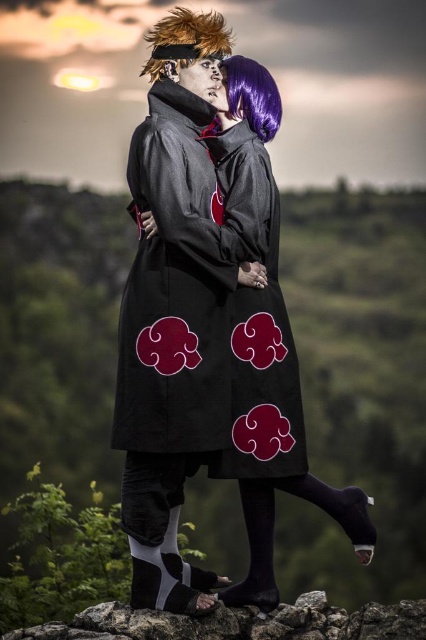
You are a photographer trying to capture a clear shot of both the black fabric cloak at center and the purple silky wig at upper center. Based on their positions, which object will appear taller in the photo?

The black fabric cloak at center will appear taller in the photo since it has a greater height compared to the purple silky wig at upper center according to the description.

You are a photographer trying to capture a closeup of the purple silky wig at upper center without the smooth rock at lower center appearing in the frame. Based on their positions, is this possible?

Yes, the smooth rock at lower center is positioned under the purple silky wig at upper center, so adjusting the camera angle slightly upward would allow the photographer to focus on the purple silky wig at upper center while excluding the rock from the frame.

You are a costume designer preparing for a play. You have two items from the image to place on a mannequin. The black fabric cloak at center and the purple silky wig at upper center. Which item will have a larger horizontal span when placed on the mannequin?

The black fabric cloak at center has a greater width than the purple silky wig at upper center, so it will have a larger horizontal span when placed on the mannequin.